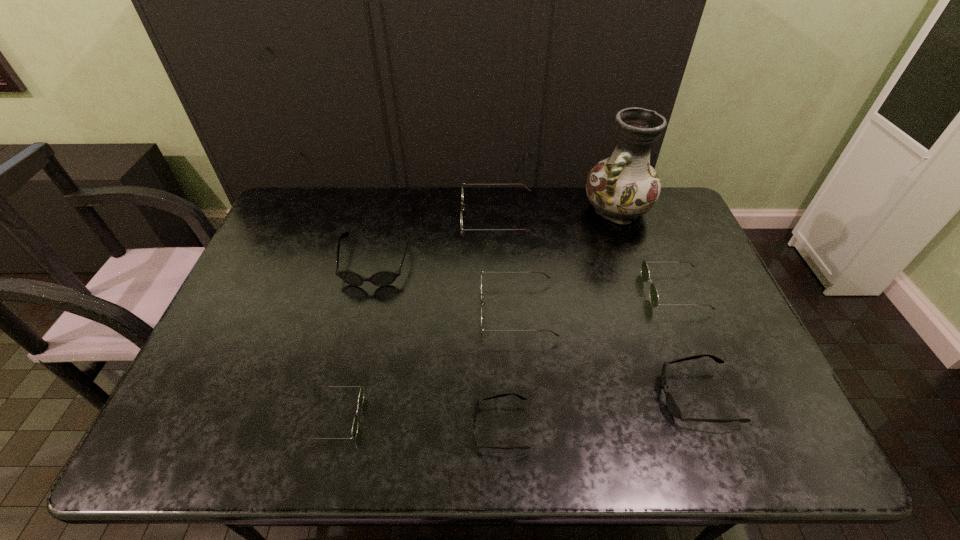
Identify the location of red vase. The height and width of the screenshot is (540, 960). (622, 187).

The width and height of the screenshot is (960, 540). In order to click on vase in this screenshot , I will do `click(622, 187)`.

The height and width of the screenshot is (540, 960). What are the coordinates of `the farthest green sunglasses` in the screenshot? It's located at (528, 189).

Where is `the second tallest object`? This screenshot has width=960, height=540. the second tallest object is located at coordinates (528, 189).

In order to click on the third smallest green sunglasses in this screenshot , I will do `click(547, 276)`.

Locate an element on the screen. the leftmost black sunglasses is located at coordinates (381, 278).

The width and height of the screenshot is (960, 540). In order to click on the biggest black sunglasses in this screenshot , I will do `click(381, 278)`.

This screenshot has height=540, width=960. Identify the location of the third biggest green sunglasses. (645, 274).

You are a GUI agent. You are given a task and a screenshot of the screen. Output one action in this format:
    pyautogui.click(x=<x>, y=<y>)
    Task: Click on the second smallest black sunglasses
    The width and height of the screenshot is (960, 540).
    Given the screenshot: What is the action you would take?
    pyautogui.click(x=673, y=407)

Locate an element on the screen. The height and width of the screenshot is (540, 960). the leftmost green sunglasses is located at coordinates (361, 395).